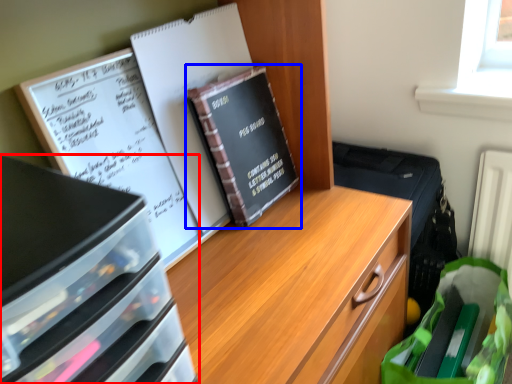
Question: Which object appears farthest to the camera in this image, desk (highlighted by a red box) or book (highlighted by a blue box)?

Choices:
 (A) desk
 (B) book

Answer: (B)